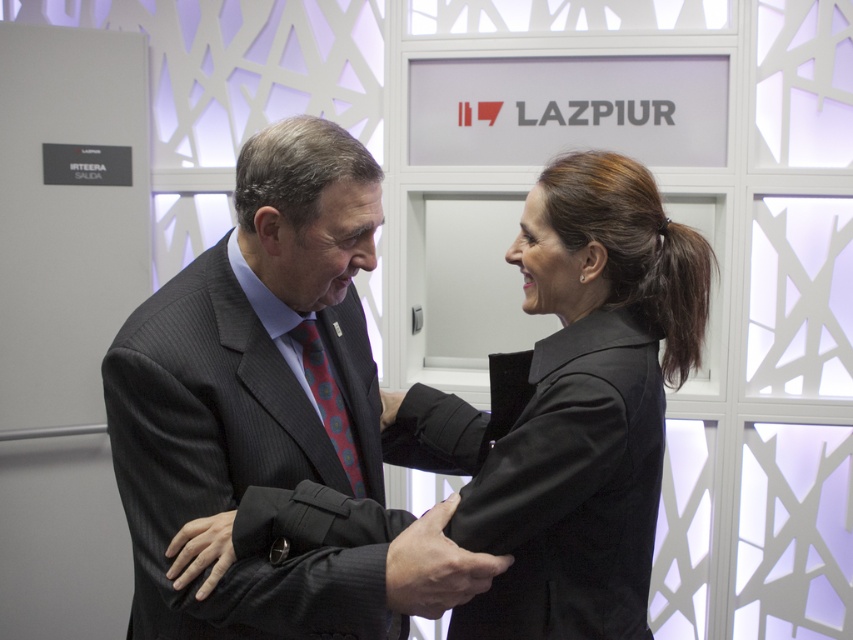
Question: Which object appears farthest from the camera in this image?

Choices:
 (A) dark gray suit at center
 (B) black matte jacket at center

Answer: (B)

Question: Does dark gray suit at center have a larger size compared to polka dot silk tie at center?

Choices:
 (A) no
 (B) yes

Answer: (B)

Question: Can you confirm if dark gray suit at center is thinner than black matte jacket at center?

Choices:
 (A) no
 (B) yes

Answer: (B)

Question: Which of the following is the farthest from the observer?

Choices:
 (A) tap(469, 451)
 (B) tap(289, 432)
 (C) tap(352, 451)

Answer: (A)

Question: Does black matte jacket at center have a smaller size compared to polka dot silk tie at center?

Choices:
 (A) yes
 (B) no

Answer: (B)

Question: Which point appears closest to the camera in this image?

Choices:
 (A) (306, 369)
 (B) (479, 474)

Answer: (B)